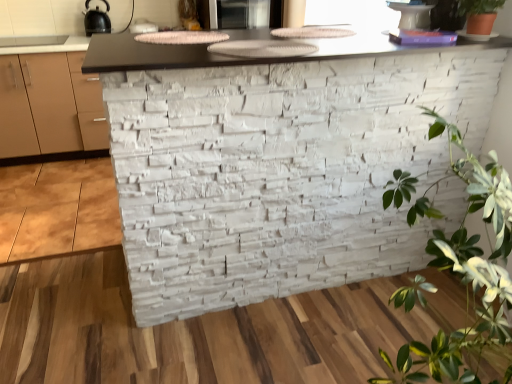
Question: Is black matte kettle at upper left, the 1th appliance viewed from the left, taller or shorter than green leafy plant at right, which ranks as the second houseplant in top-to-bottom order?

Choices:
 (A) short
 (B) tall

Answer: (A)

Question: In the image, is black matte kettle at upper left, the 1th appliance viewed from the left, positioned in front of or behind green leafy plant at right, which is counted as the 1th houseplant, starting from the bottom?

Choices:
 (A) behind
 (B) front

Answer: (A)

Question: Which of these objects is positioned closest to the white stone wall at center?

Choices:
 (A) green matte plant at upper right, marked as the first houseplant in a top-to-bottom arrangement
 (B) matte black microwave at upper center, the 1th appliance positioned from the right
 (C) black matte kettle at upper left, the 1th appliance viewed from the left
 (D) green leafy plant at right, which ranks as the second houseplant in top-to-bottom order

Answer: (D)

Question: Which object is positioned closest to the green matte plant at upper right, marked as the first houseplant in a top-to-bottom arrangement?

Choices:
 (A) green leafy plant at right, which is counted as the 1th houseplant, starting from the bottom
 (B) white stone wall at center
 (C) matte black microwave at upper center, the 1th appliance positioned from the right
 (D) black matte kettle at upper left, the 1th appliance viewed from the left

Answer: (A)